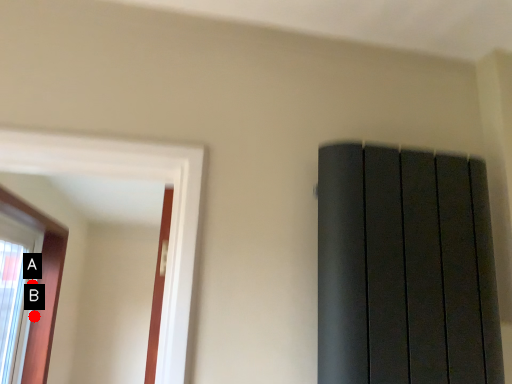
Question: Two points are circled on the image, labeled by A and B beside each circle. Which point is closer to the camera?

Choices:
 (A) A is closer
 (B) B is closer

Answer: (B)